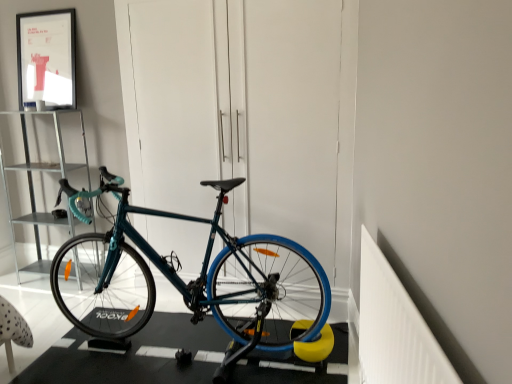
Question: Does metallic silver shelf at left touch teal matte bicycle at center?

Choices:
 (A) yes
 (B) no

Answer: (B)

Question: From the image's perspective, is metallic silver shelf at left beneath teal matte bicycle at center?

Choices:
 (A) yes
 (B) no

Answer: (B)

Question: Does metallic silver shelf at left appear on the left side of teal matte bicycle at center?

Choices:
 (A) yes
 (B) no

Answer: (A)

Question: Is metallic silver shelf at left further to the viewer compared to teal matte bicycle at center?

Choices:
 (A) yes
 (B) no

Answer: (A)

Question: From a real-world perspective, is metallic silver shelf at left below teal matte bicycle at center?

Choices:
 (A) no
 (B) yes

Answer: (A)

Question: Does metallic silver shelf at left have a greater height compared to teal matte bicycle at center?

Choices:
 (A) no
 (B) yes

Answer: (B)

Question: Can you confirm if teal matte bicycle at center is bigger than matte black picture frame at upper left?

Choices:
 (A) no
 (B) yes

Answer: (B)

Question: Can you confirm if teal matte bicycle at center is positioned to the left of matte black picture frame at upper left?

Choices:
 (A) yes
 (B) no

Answer: (B)

Question: Is teal matte bicycle at center wider than matte black picture frame at upper left?

Choices:
 (A) yes
 (B) no

Answer: (A)

Question: Considering the relative sizes of teal matte bicycle at center and matte black picture frame at upper left in the image provided, is teal matte bicycle at center shorter than matte black picture frame at upper left?

Choices:
 (A) no
 (B) yes

Answer: (A)

Question: From the image's perspective, is teal matte bicycle at center on matte black picture frame at upper left?

Choices:
 (A) no
 (B) yes

Answer: (A)

Question: Can you confirm if teal matte bicycle at center is smaller than matte black picture frame at upper left?

Choices:
 (A) yes
 (B) no

Answer: (B)

Question: Does matte black picture frame at upper left have a greater width compared to metallic silver shelf at left?

Choices:
 (A) yes
 (B) no

Answer: (B)